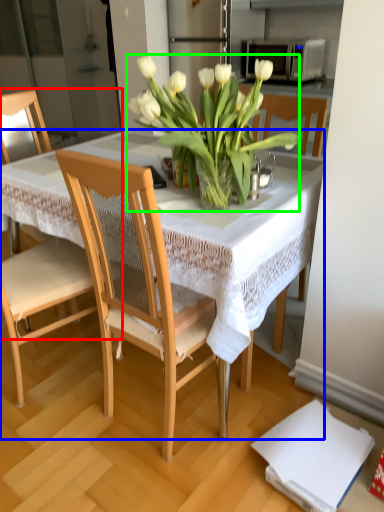
Question: Which is nearer to the chair (highlighted by a red box)? table (highlighted by a blue box) or flower (highlighted by a green box).

Choices:
 (A) table
 (B) flower

Answer: (A)